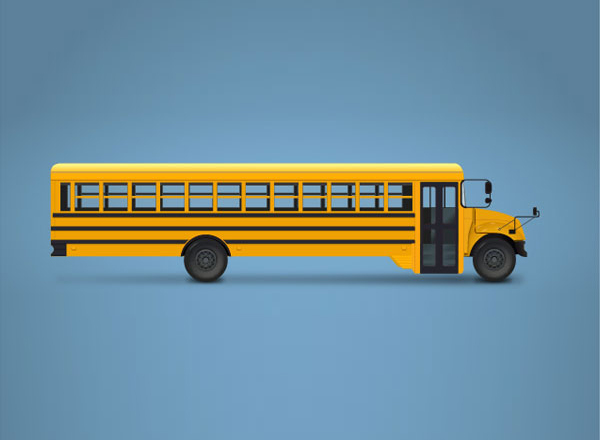
Where is `upper left quadrant of door`? The width and height of the screenshot is (600, 440). upper left quadrant of door is located at coordinates (430, 205).